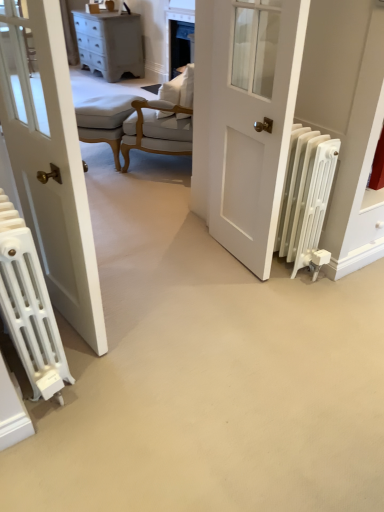
Where is `free space that is to the left of white matte door at center`? free space that is to the left of white matte door at center is located at coordinates (178, 262).